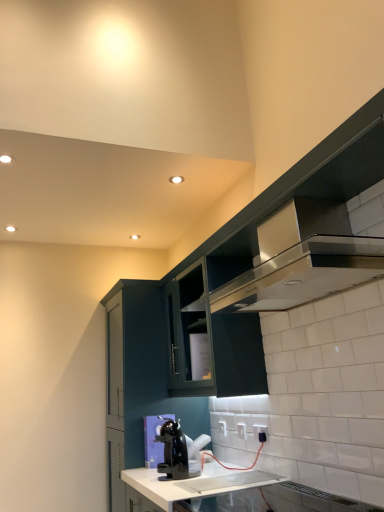
Question: Is satin silver exhaust hood at upper right placed right next to white plastic electric outlet at lower center, which ranks as the 2th electric outlet in right-to-left order?

Choices:
 (A) yes
 (B) no

Answer: (B)

Question: From a real-world perspective, is satin silver exhaust hood at upper right below white plastic electric outlet at lower center, positioned as the 2th electric outlet in front-to-back order?

Choices:
 (A) no
 (B) yes

Answer: (A)

Question: From the image's perspective, would you say satin silver exhaust hood at upper right is positioned over white plastic electric outlet at lower center, positioned as the 2th electric outlet in front-to-back order?

Choices:
 (A) no
 (B) yes

Answer: (B)

Question: Does satin silver exhaust hood at upper right have a lesser width compared to white plastic electric outlet at lower center, which is the second electric outlet in left-to-right order?

Choices:
 (A) yes
 (B) no

Answer: (B)

Question: Does satin silver exhaust hood at upper right lie behind white plastic electric outlet at lower center, positioned as the 2th electric outlet in front-to-back order?

Choices:
 (A) yes
 (B) no

Answer: (B)

Question: In the image, is black plastic coffee maker at lower center positioned in front of or behind satin silver exhaust hood at upper right?

Choices:
 (A) front
 (B) behind

Answer: (B)

Question: In terms of width, does black plastic coffee maker at lower center look wider or thinner when compared to satin silver exhaust hood at upper right?

Choices:
 (A) thin
 (B) wide

Answer: (A)

Question: From the image's perspective, relative to satin silver exhaust hood at upper right, is black plastic coffee maker at lower center above or below?

Choices:
 (A) below
 (B) above

Answer: (A)

Question: Is black plastic coffee maker at lower center taller or shorter than satin silver exhaust hood at upper right?

Choices:
 (A) tall
 (B) short

Answer: (B)

Question: From their relative heights in the image, would you say satin black cabinet at upper right, arranged as the 1th cabinetry when viewed from the right, is taller or shorter than matte dark green cabinet at center, which is the first cabinetry from left to right?

Choices:
 (A) short
 (B) tall

Answer: (A)

Question: Is point (230, 228) closer or farther from the camera than point (135, 418)?

Choices:
 (A) farther
 (B) closer

Answer: (B)

Question: Looking at their shapes, would you say satin black cabinet at upper right, arranged as the 1th cabinetry when viewed from the right, is wider or thinner than matte dark green cabinet at center, which is the first cabinetry from left to right?

Choices:
 (A) wide
 (B) thin

Answer: (B)

Question: From the image's perspective, is satin black cabinet at upper right, arranged as the 1th cabinetry when viewed from the right, positioned above or below matte dark green cabinet at center, which is the first cabinetry from left to right?

Choices:
 (A) above
 (B) below

Answer: (A)

Question: Is point (144, 456) positioned closer to the camera than point (175, 492)?

Choices:
 (A) farther
 (B) closer

Answer: (A)

Question: In the image, is matte dark green cabinet at center, which is the first cabinetry from left to right, positioned in front of or behind white glossy countertop at lower center?

Choices:
 (A) front
 (B) behind

Answer: (B)